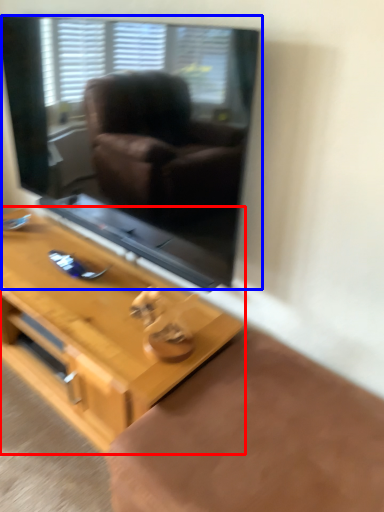
Question: Among these objects, which one is nearest to the camera, table (highlighted by a red box) or window screen (highlighted by a blue box)?

Choices:
 (A) table
 (B) window screen

Answer: (B)